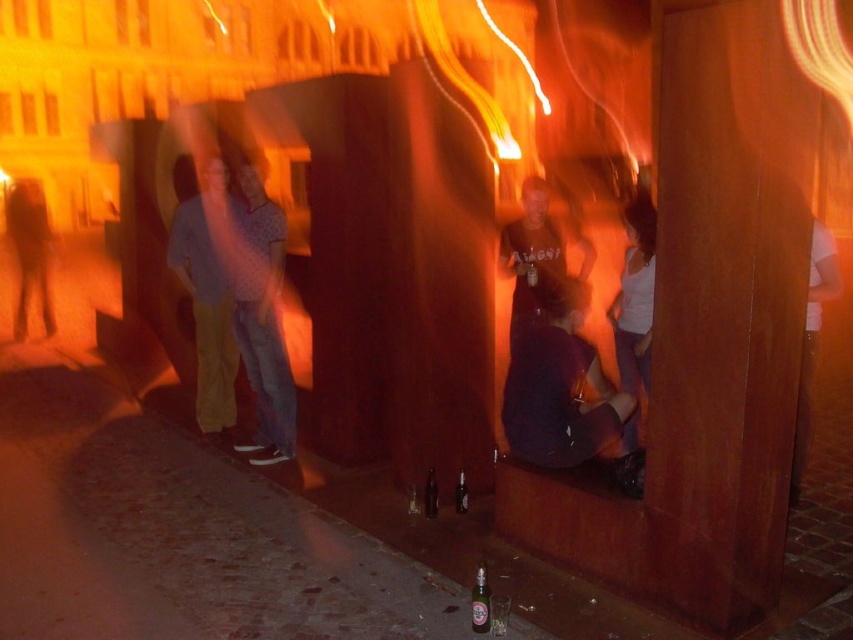
You are a photographer standing at the edge of the cobblestone ground in the nighttime scene. You want to capture a photo that includes both the white cotton tank top at center and the translucent glass bottle at center. Can you frame them in a single shot without moving either object?

The distance between the white cotton tank top at center and the translucent glass bottle at center is 4.70 feet, so yes, they can be framed in a single shot as they are within a reasonable distance apart.

You are at the event and want to find the dark purple fabric at center. Where should you look relative to the matte yellow pants at left?

The dark purple fabric at center is located below the matte yellow pants at left, so you should look downward from the matte yellow pants at left to find it.

You are at a nighttime event and see the dark purple fabric at center and the translucent glass bottle at center. Which object takes up more space in the scene?

The dark purple fabric at center is bigger than the translucent glass bottle at center, so it takes up more space in the scene.